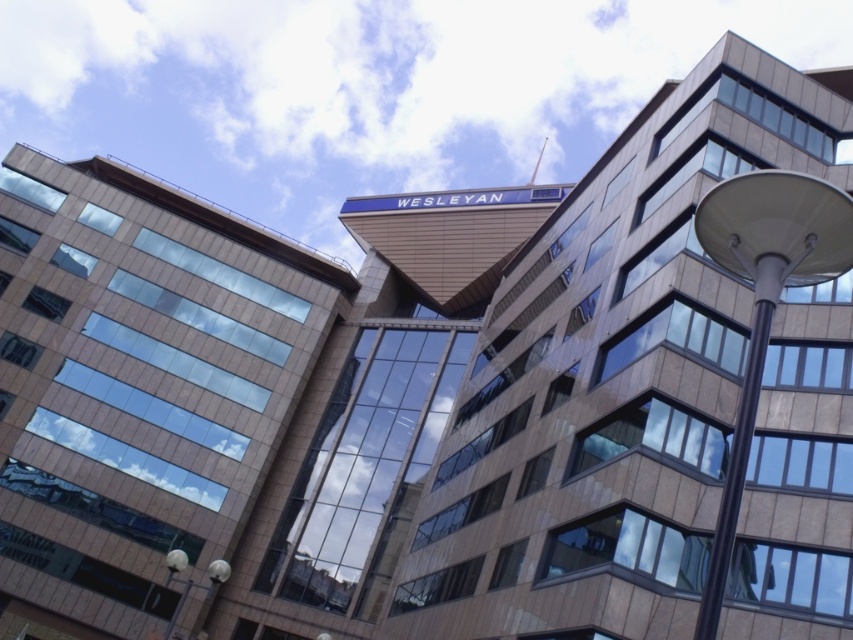
Question: Is brown stone building at upper center behind white glossy streetlight at right?

Choices:
 (A) yes
 (B) no

Answer: (B)

Question: Which object is closer to the camera taking this photo?

Choices:
 (A) brown stone building at upper center
 (B) white glossy streetlight at right

Answer: (A)

Question: Is brown stone building at upper center to the left of white glossy streetlight at right from the viewer's perspective?

Choices:
 (A) no
 (B) yes

Answer: (A)

Question: Which point is farther to the camera?

Choices:
 (A) white glossy streetlight at right
 (B) brown stone building at upper center

Answer: (A)

Question: Does brown stone building at upper center have a larger size compared to white glossy streetlight at right?

Choices:
 (A) yes
 (B) no

Answer: (A)